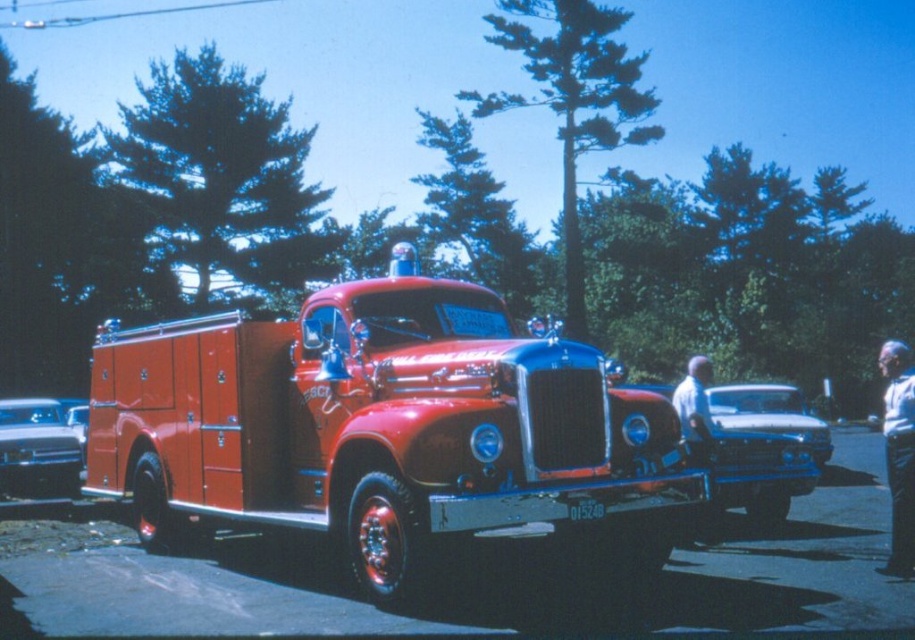
Who is positioned more to the right, shiny red fire truck at center or shiny silver sedan at left?

From the viewer's perspective, shiny red fire truck at center appears more on the right side.

Which of these two, shiny red fire truck at center or shiny silver sedan at left, stands taller?

Standing taller between the two is shiny red fire truck at center.

What do you see at coordinates (373, 426) in the screenshot? I see `shiny red fire truck at center` at bounding box center [373, 426].

At what (x,y) coordinates should I click in order to perform the action: click on shiny red fire truck at center. Please return your answer as a coordinate pair (x, y). The width and height of the screenshot is (915, 640). Looking at the image, I should click on (373, 426).

Looking at this image, who is shorter, metallic red fire truck at center or shiny silver sedan at left?

metallic red fire truck at center

This screenshot has width=915, height=640. Identify the location of metallic red fire truck at center. (479, 580).

What do you see at coordinates (373, 426) in the screenshot?
I see `shiny red fire truck at center` at bounding box center [373, 426].

Which is below, shiny red fire truck at center or metallic red fire truck at center?

metallic red fire truck at center is below.

Identify the location of shiny red fire truck at center. The image size is (915, 640). (373, 426).

The image size is (915, 640). I want to click on shiny red fire truck at center, so click(373, 426).